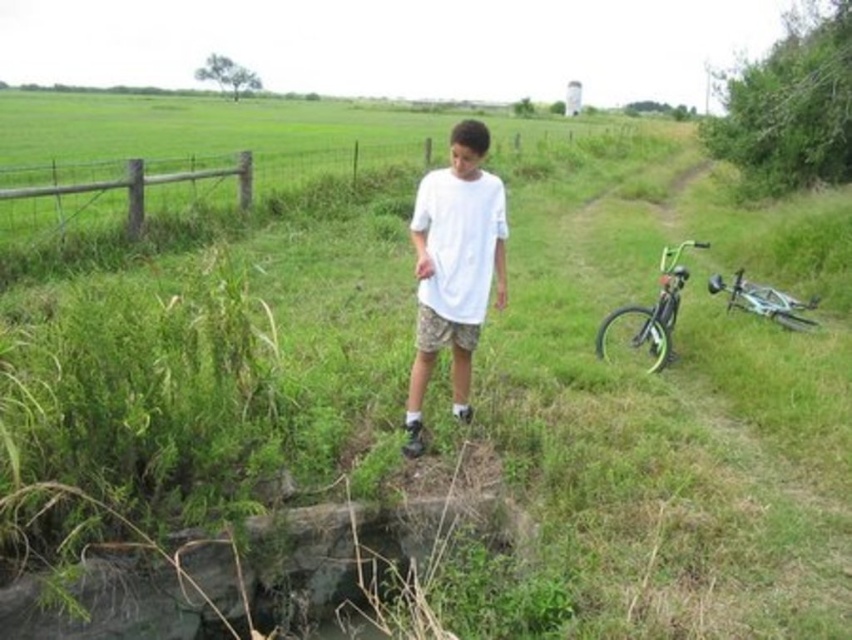
You are a fashion designer analyzing clothing proportions in the scene. Given the white matte shirt at center and the camouflage fabric shorts at center, which clothing item has a greater horizontal span when viewed from the front?

The white matte shirt at center has a greater horizontal span than the camouflage fabric shorts at center, as its width is larger according to the description.

You are a photographer trying to capture the white matte shirt at center and the metallic silver bicycle at right in a single frame. Based on their positions, can you determine which object is closer to the camera?

The white matte shirt at center is above the metallic silver bicycle at right, which means it is closer to the camera since objects higher in the frame are typically nearer in such compositions.